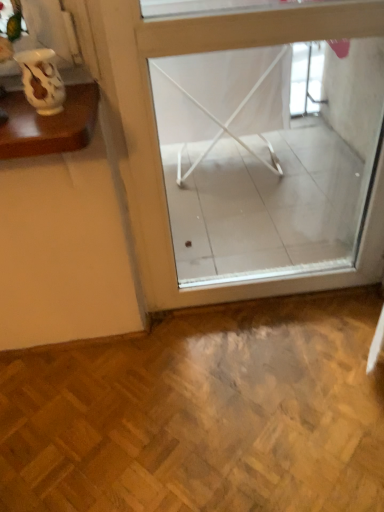
What is the approximate width of transparent glass window at center?

transparent glass window at center is 3.71 inches in width.

You are a GUI agent. You are given a task and a screenshot of the screen. Output one action in this format:
    pyautogui.click(x=<x>, y=<y>)
    Task: Click on the transparent glass window at center
    This screenshot has height=512, width=384.
    Given the screenshot: What is the action you would take?
    pyautogui.click(x=158, y=141)

This screenshot has height=512, width=384. What do you see at coordinates (158, 141) in the screenshot?
I see `transparent glass window at center` at bounding box center [158, 141].

Find the location of a particular element. This screenshot has height=512, width=384. matte white vase at upper left is located at coordinates (42, 80).

Describe the element at coordinates (42, 80) in the screenshot. The width and height of the screenshot is (384, 512). I see `matte white vase at upper left` at that location.

Identify the location of transparent glass window at center. The width and height of the screenshot is (384, 512). (158, 141).

Visually, is transparent glass window at center positioned to the left or to the right of matte white vase at upper left?

Based on their positions, transparent glass window at center is located to the right of matte white vase at upper left.

Which object is closer to the camera taking this photo, transparent glass window at center or matte white vase at upper left?

Positioned in front is matte white vase at upper left.

Is point (203, 302) closer to viewer compared to point (46, 51)?

No, it is not.

From the image's perspective, which object appears higher, transparent glass window at center or matte white vase at upper left?

matte white vase at upper left is shown above in the image.

From a real-world perspective, which is physically below, transparent glass window at center or matte white vase at upper left?

From a 3D spatial view, transparent glass window at center is below.

In the scene shown: Considering the relative sizes of transparent glass window at center and matte white vase at upper left in the image provided, is transparent glass window at center thinner than matte white vase at upper left?

In fact, transparent glass window at center might be wider than matte white vase at upper left.

Between transparent glass window at center and matte white vase at upper left, which one has less height?

matte white vase at upper left.

Which of these two, transparent glass window at center or matte white vase at upper left, is smaller?

matte white vase at upper left.

Is transparent glass window at center spatially inside matte white vase at upper left, or outside of it?

transparent glass window at center cannot be found inside matte white vase at upper left.

Are transparent glass window at center and matte white vase at upper left making contact?

transparent glass window at center and matte white vase at upper left are not in contact.

Does transparent glass window at center turn towards matte white vase at upper left?

No, transparent glass window at center is not turned towards matte white vase at upper left.

How many degrees apart are the facing directions of transparent glass window at center and matte white vase at upper left?

They differ by 0.000241 degrees in their facing directions.

Locate an element on the screen. The image size is (384, 512). vase that is in front of the transparent glass window at center is located at coordinates (42, 80).

Considering the positions of objects matte white vase at upper left and transparent glass window at center in the image provided, who is more to the left, matte white vase at upper left or transparent glass window at center?

From the viewer's perspective, matte white vase at upper left appears more on the left side.

Which object is more forward, matte white vase at upper left or transparent glass window at center?

matte white vase at upper left is closer to the camera.

Considering the points (47, 72) and (209, 45), which point is in front, point (47, 72) or point (209, 45)?

The point (47, 72) is closer.

From the image's perspective, relative to transparent glass window at center, is matte white vase at upper left above or below?

matte white vase at upper left is situated higher than transparent glass window at center in the image.

From a real-world perspective, is matte white vase at upper left on top of transparent glass window at center?

Indeed, from a real-world perspective, matte white vase at upper left stands above transparent glass window at center.

Does matte white vase at upper left have a lesser width compared to transparent glass window at center?

Yes, matte white vase at upper left is thinner than transparent glass window at center.

Considering the relative sizes of matte white vase at upper left and transparent glass window at center in the image provided, is matte white vase at upper left shorter than transparent glass window at center?

Yes, matte white vase at upper left is shorter than transparent glass window at center.

Consider the image. Does matte white vase at upper left have a larger size compared to transparent glass window at center?

No, matte white vase at upper left is not bigger than transparent glass window at center.

Is matte white vase at upper left not within transparent glass window at center?

Yes.

Is matte white vase at upper left in contact with transparent glass window at center?

No, matte white vase at upper left is not making contact with transparent glass window at center.

Is matte white vase at upper left aimed at transparent glass window at center?

No, matte white vase at upper left is not aimed at transparent glass window at center.

Can you tell me how much matte white vase at upper left and transparent glass window at center differ in facing direction?

0.000241 degrees separate the facing orientations of matte white vase at upper left and transparent glass window at center.

Identify the location of window behind the matte white vase at upper left. The height and width of the screenshot is (512, 384). pyautogui.click(x=158, y=141).

In order to click on window below the matte white vase at upper left (from the image's perspective) in this screenshot , I will do `click(158, 141)`.

This screenshot has height=512, width=384. What are the coordinates of `vase above the transparent glass window at center (from a real-world perspective)` in the screenshot? It's located at (42, 80).